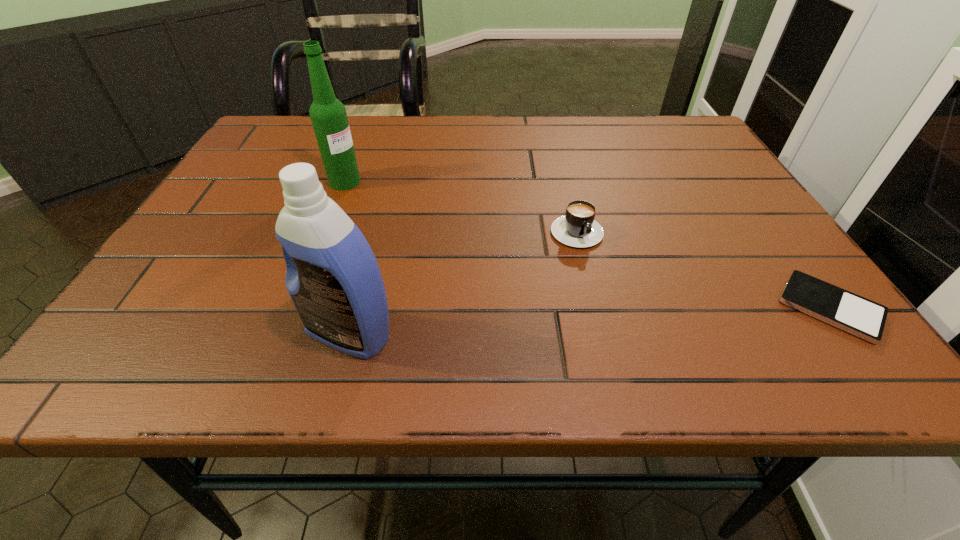
Locate an element on the screen. This screenshot has height=540, width=960. free space at the near left corner of the desktop is located at coordinates (219, 291).

The width and height of the screenshot is (960, 540). I want to click on vacant area between the cappuccino and the farthest object, so click(460, 204).

This screenshot has width=960, height=540. In order to click on blank region between the farthest object and the third nearest object in this screenshot , I will do [460, 204].

I want to click on free space that is in between the third nearest object and the shortest object, so click(x=703, y=267).

The height and width of the screenshot is (540, 960). I want to click on free space between the third object from left to right and the iPod, so click(x=703, y=267).

The image size is (960, 540). In order to click on vacant space that is in between the rightmost object and the detergent in this screenshot , I will do `click(589, 320)`.

This screenshot has width=960, height=540. In order to click on free point between the rightmost object and the detergent in this screenshot , I will do `click(589, 320)`.

Locate an element on the screen. This screenshot has height=540, width=960. object that can be found as the closest to the detergent is located at coordinates (577, 228).

At what (x,y) coordinates should I click in order to perform the action: click on the closest object to the detergent. Please return your answer as a coordinate pair (x, y). Image resolution: width=960 pixels, height=540 pixels. Looking at the image, I should click on (577, 228).

Where is `free point that satisfies the following two spatial constraints: 1. on the back side of the detergent; 2. on the right side of the cappuccino`? free point that satisfies the following two spatial constraints: 1. on the back side of the detergent; 2. on the right side of the cappuccino is located at coordinates (377, 226).